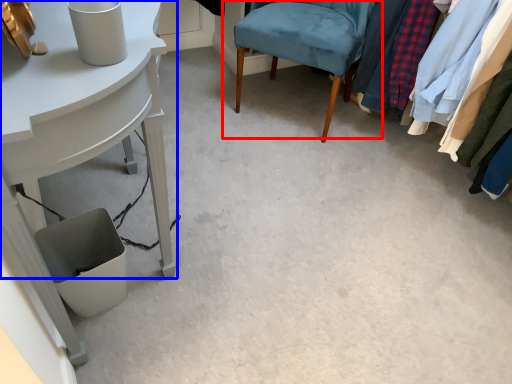
Question: Which object is closer to the camera taking this photo, chair (highlighted by a red box) or table (highlighted by a blue box)?

Choices:
 (A) chair
 (B) table

Answer: (B)